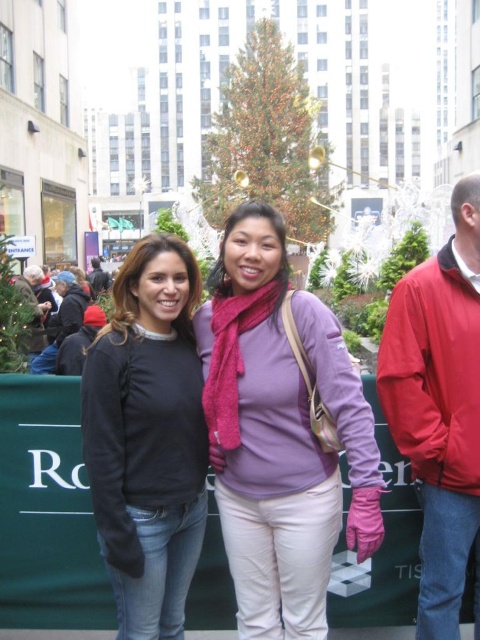
Does purple matte scarf at center have a greater height compared to brushed metal water at bottle left?

Indeed, purple matte scarf at center has a greater height compared to brushed metal water at bottle left.

Is point (347, 381) closer to camera compared to point (26, 276)?

That is True.

The height and width of the screenshot is (640, 480). Identify the location of purple matte scarf at center. (264, 438).

Which is more to the left, green matte christmas tree at center or brushed metal water at bottle left?

Positioned to the left is brushed metal water at bottle left.

Between green matte christmas tree at center and brushed metal water at bottle left, which one has more height?

Standing taller between the two is brushed metal water at bottle left.

Does point (409, 248) come closer to viewer compared to point (39, 272)?

Yes.

The height and width of the screenshot is (640, 480). What are the coordinates of `green matte christmas tree at center` in the screenshot? It's located at (404, 257).

Can you confirm if purple matte scarf at center is positioned below green textured christmas tree at center?

Yes, purple matte scarf at center is below green textured christmas tree at center.

Does purple matte scarf at center appear on the left side of green textured christmas tree at center?

In fact, purple matte scarf at center is to the right of green textured christmas tree at center.

Is point (303, 531) less distant than point (308, 108)?

Yes, point (303, 531) is in front of point (308, 108).

Locate an element on the screen. The height and width of the screenshot is (640, 480). purple matte scarf at center is located at coordinates (264, 438).